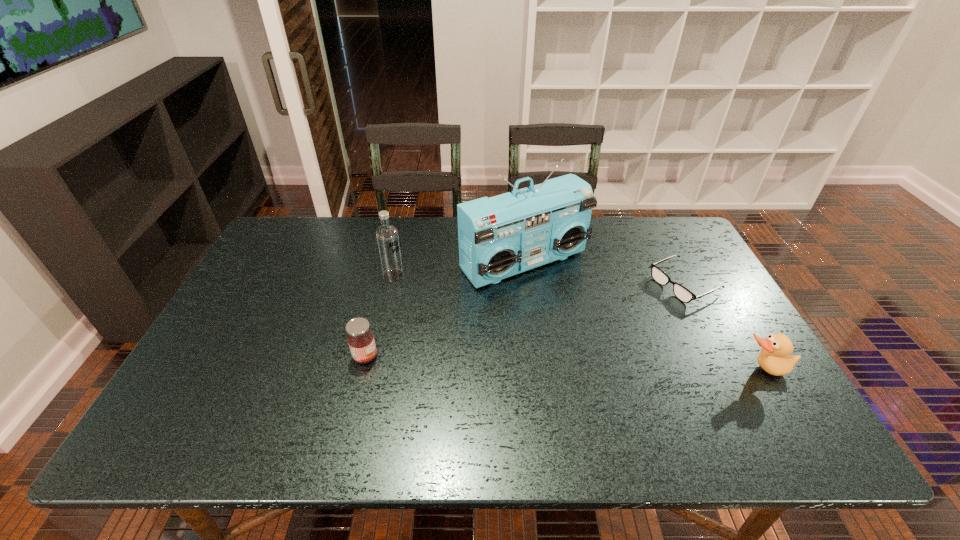
What are the coordinates of `spectacles positioned at the right edge` in the screenshot? It's located at (682, 293).

Image resolution: width=960 pixels, height=540 pixels. I want to click on object situated at the near right corner, so click(773, 358).

The width and height of the screenshot is (960, 540). In the image, there is a desktop. In order to click on vacant region at the far edge in this screenshot , I will do `click(418, 226)`.

Where is `free region at the near edge of the desktop`? free region at the near edge of the desktop is located at coordinates (532, 380).

Locate an element on the screen. Image resolution: width=960 pixels, height=540 pixels. vacant space at the left edge of the desktop is located at coordinates (228, 311).

The width and height of the screenshot is (960, 540). What are the coordinates of `vacant point at the right edge` in the screenshot? It's located at (738, 365).

You are a GUI agent. You are given a task and a screenshot of the screen. Output one action in this format:
    pyautogui.click(x=<x>, y=<y>)
    Task: Click on the free space at the far right corner of the desktop
    This screenshot has height=540, width=960.
    Given the screenshot: What is the action you would take?
    672,235

In the image, there is a desktop. What are the coordinates of `blank space at the near right corner` in the screenshot? It's located at (734, 393).

This screenshot has height=540, width=960. I want to click on vacant space in between the duck and the jam, so click(564, 363).

Where is `vacant point located between the duck and the spectacles`? vacant point located between the duck and the spectacles is located at coordinates (724, 327).